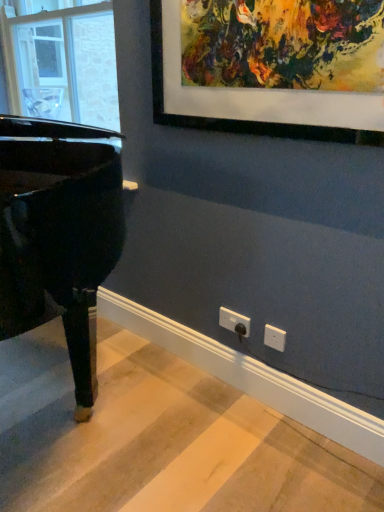
Question: Is glossy black piano at left positioned beyond the bounds of transparent glass window at left?

Choices:
 (A) yes
 (B) no

Answer: (A)

Question: Is glossy black piano at left wider than transparent glass window at left?

Choices:
 (A) no
 (B) yes

Answer: (B)

Question: Can you confirm if glossy black piano at left is bigger than transparent glass window at left?

Choices:
 (A) yes
 (B) no

Answer: (A)

Question: Is transparent glass window at left located within glossy black piano at left?

Choices:
 (A) yes
 (B) no

Answer: (B)

Question: From a real-world perspective, is glossy black piano at left positioned under transparent glass window at left based on gravity?

Choices:
 (A) yes
 (B) no

Answer: (A)

Question: In the image, is transparent glass window at left positioned in front of or behind white plastic electric outlet at lower center?

Choices:
 (A) front
 (B) behind

Answer: (B)

Question: Is transparent glass window at left bigger or smaller than white plastic electric outlet at lower center?

Choices:
 (A) big
 (B) small

Answer: (A)

Question: From the image's perspective, is transparent glass window at left above or below white plastic electric outlet at lower center?

Choices:
 (A) below
 (B) above

Answer: (B)

Question: Does point (18, 68) appear closer or farther from the camera than point (236, 330)?

Choices:
 (A) farther
 (B) closer

Answer: (A)

Question: Is white plastic electric outlet at lower center to the left or to the right of transparent glass window at left in the image?

Choices:
 (A) right
 (B) left

Answer: (A)

Question: Which is correct: white plastic electric outlet at lower center is inside transparent glass window at left, or outside of it?

Choices:
 (A) outside
 (B) inside

Answer: (A)

Question: Considering the positions of white plastic electric outlet at lower center and transparent glass window at left in the image, is white plastic electric outlet at lower center bigger or smaller than transparent glass window at left?

Choices:
 (A) big
 (B) small

Answer: (B)

Question: From the image's perspective, is white plastic electric outlet at lower center positioned above or below transparent glass window at left?

Choices:
 (A) below
 (B) above

Answer: (A)

Question: Looking at the image, does transparent glass window at left seem bigger or smaller compared to glossy black piano at left?

Choices:
 (A) big
 (B) small

Answer: (B)

Question: From the image's perspective, is transparent glass window at left positioned above or below glossy black piano at left?

Choices:
 (A) below
 (B) above

Answer: (B)